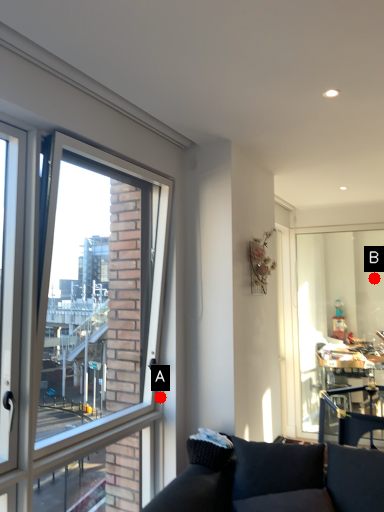
Question: Two points are circled on the image, labeled by A and B beside each circle. Which of the following is the farthest from the observer?

Choices:
 (A) A is further
 (B) B is further

Answer: (B)